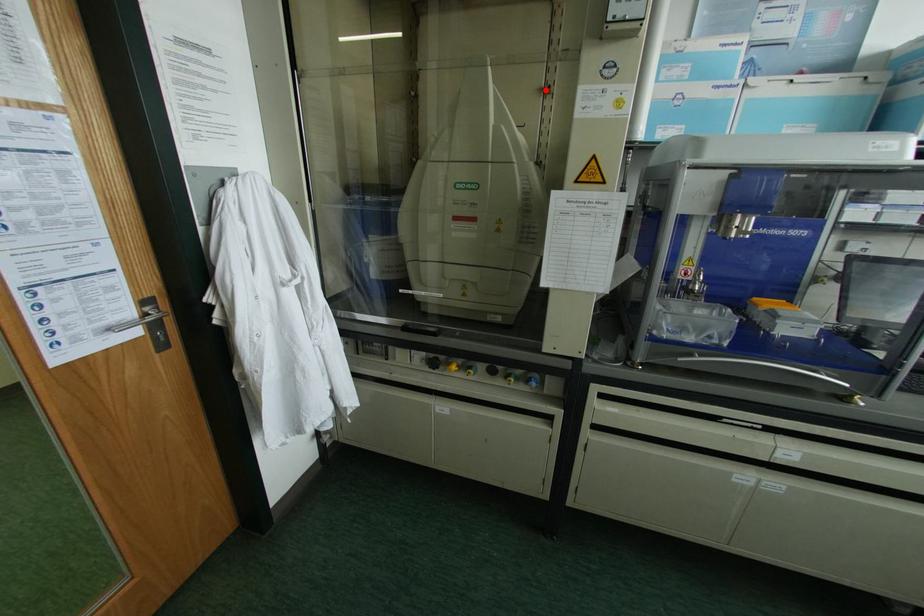
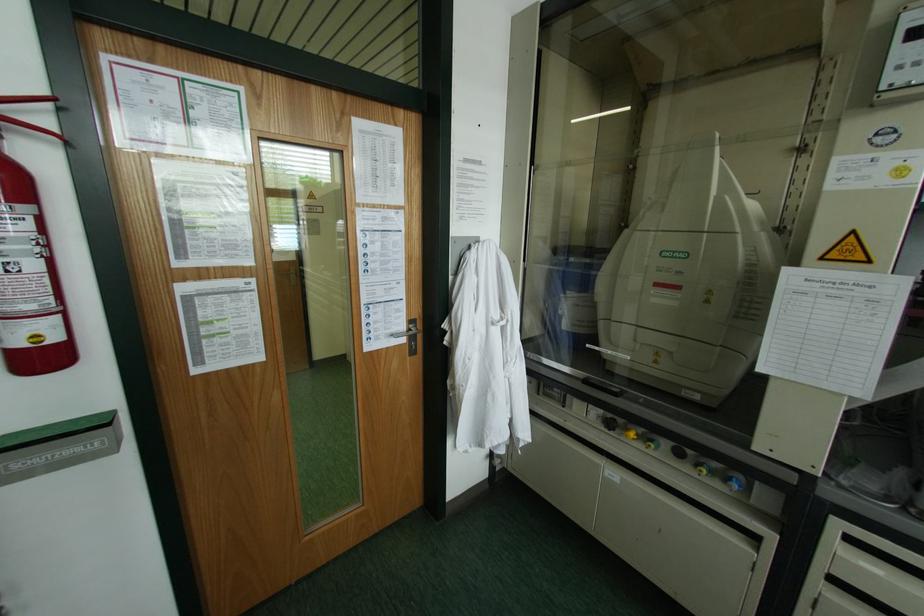
Question: I am providing you with two images of the same scene from different viewpoints. A red point is marked on the first image. At the location where the point appears in image 1, is it still visible in image 2?

Choices:
 (A) Yes
 (B) No

Answer: (A)